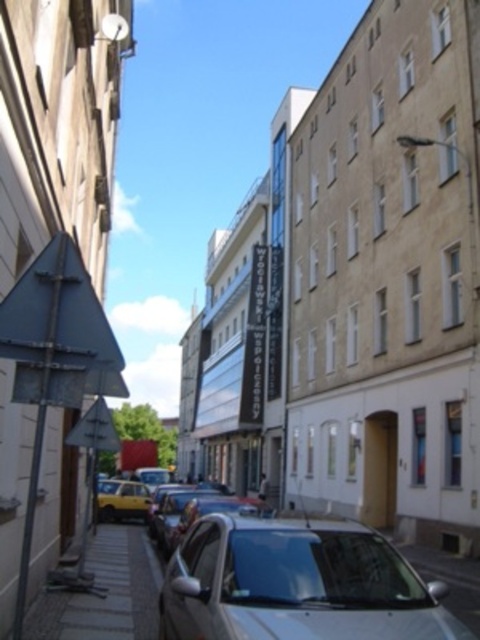
Question: Does paved stone alley at lower left appear over yellow matte car at lower left?

Choices:
 (A) no
 (B) yes

Answer: (B)

Question: Which of the following is the closest to the observer?

Choices:
 (A) (422, 620)
 (B) (155, 621)

Answer: (A)

Question: Which is nearer to the paved stone alley at lower left?

Choices:
 (A) yellow matte car at lower left
 (B) silver metallic car at lower center

Answer: (B)

Question: Can you confirm if paved stone alley at lower left is smaller than yellow matte car at lower left?

Choices:
 (A) no
 (B) yes

Answer: (A)

Question: Based on their relative distances, which object is farther from the silver metallic car at lower center?

Choices:
 (A) paved stone alley at lower left
 (B) yellow matte car at lower left

Answer: (B)

Question: Is silver metallic car at lower center bigger than paved stone alley at lower left?

Choices:
 (A) no
 (B) yes

Answer: (A)